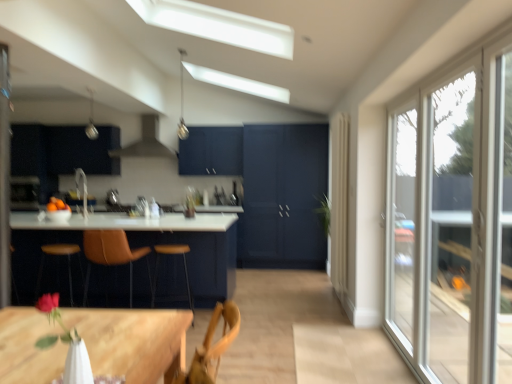
Describe the element at coordinates (91, 118) in the screenshot. I see `silver metallic light fixture at upper center, which ranks as the 1th light fixture in left-to-right order` at that location.

Identify the location of silver metallic light fixture at upper center, which ranks as the 1th light fixture in left-to-right order. (91, 118).

You are a GUI agent. You are given a task and a screenshot of the screen. Output one action in this format:
    pyautogui.click(x=<x>, y=<y>)
    Task: Click on the brown leather bar stool at left, the second bar stool in the right-to-left sequence
    This screenshot has height=384, width=512.
    Given the screenshot: What is the action you would take?
    pyautogui.click(x=60, y=255)

Describe the element at coordinates (172, 254) in the screenshot. I see `brown leather bar stool at center, marked as the second bar stool in a left-to-right arrangement` at that location.

Find the location of `matte white exhaust hood at upper center`. matte white exhaust hood at upper center is located at coordinates (146, 142).

How much distance is there between wooden table at lower left, the 2th table when ordered from front to back, and brown leather bar stool at left, the second bar stool in the right-to-left sequence?

wooden table at lower left, the 2th table when ordered from front to back, is 61.97 centimeters from brown leather bar stool at left, the second bar stool in the right-to-left sequence.

Considering the points (227, 263) and (70, 275), which point is behind, point (227, 263) or point (70, 275)?

Point (70, 275)

Can you confirm if wooden table at lower left, the second table from the right, is wider than brown leather bar stool at left, the second bar stool in the right-to-left sequence?

Correct, the width of wooden table at lower left, the second table from the right, exceeds that of brown leather bar stool at left, the second bar stool in the right-to-left sequence.

Is wooden table at lower left, the second table from the right, inside the boundaries of brown leather bar stool at left, arranged as the 1th bar stool when viewed from the left, or outside?

wooden table at lower left, the second table from the right, lies outside brown leather bar stool at left, arranged as the 1th bar stool when viewed from the left.

From a real-world perspective, is orange matte bowl at left over brown leather bar stool at center, marked as the second bar stool in a left-to-right arrangement?

Yes, from a real-world perspective, orange matte bowl at left is above brown leather bar stool at center, marked as the second bar stool in a left-to-right arrangement.

Between orange matte bowl at left and brown leather bar stool at center, which is the 1th bar stool in right-to-left order, which one has smaller width?

With smaller width is orange matte bowl at left.

Is orange matte bowl at left bigger or smaller than brown leather bar stool at center, which is the 1th bar stool in right-to-left order?

In the image, orange matte bowl at left appears to be smaller than brown leather bar stool at center, which is the 1th bar stool in right-to-left order.

From a real-world perspective, does clear glass window at right sit lower than wooden table at lower left, the 2th table when ordered from front to back?

No, from a real-world perspective, clear glass window at right is not below wooden table at lower left, the 2th table when ordered from front to back.

Is clear glass window at right not near wooden table at lower left, the 2th table when ordered from front to back?

Yes.

Is clear glass window at right not within wooden table at lower left, the second table from the right?

Yes, clear glass window at right is not within wooden table at lower left, the second table from the right.

Considering the relative positions of silver metallic light fixture at upper center, the 2th light fixture from the right, and matte white exhaust hood at upper center in the image provided, is silver metallic light fixture at upper center, the 2th light fixture from the right, to the left of matte white exhaust hood at upper center from the viewer's perspective?

Indeed, silver metallic light fixture at upper center, the 2th light fixture from the right, is positioned on the left side of matte white exhaust hood at upper center.

How different are the orientations of silver metallic light fixture at upper center, the 2th light fixture from the right, and matte white exhaust hood at upper center in degrees?

The facing directions of silver metallic light fixture at upper center, the 2th light fixture from the right, and matte white exhaust hood at upper center are 91.4 degrees apart.

Can you confirm if silver metallic light fixture at upper center, which ranks as the 1th light fixture in left-to-right order, is bigger than matte white exhaust hood at upper center?

No.

In the scene shown: From the image's perspective, which one is positioned lower, silver metallic light fixture at upper center, the 2th light fixture from the right, or matte white exhaust hood at upper center?

matte white exhaust hood at upper center.

Can you confirm if matte black cabinet at upper left is positioned to the right of matte white exhaust hood at upper center?

No.

Is matte black cabinet at upper left outside of matte white exhaust hood at upper center?

Absolutely, matte black cabinet at upper left is external to matte white exhaust hood at upper center.

From a real-world perspective, is matte black cabinet at upper left positioned under matte white exhaust hood at upper center based on gravity?

Yes, from a real-world perspective, matte black cabinet at upper left is below matte white exhaust hood at upper center.

From the picture: Is matte black cabinet at upper left directly adjacent to matte white exhaust hood at upper center?

No, matte black cabinet at upper left is not making contact with matte white exhaust hood at upper center.

From a real-world perspective, who is located lower, brown leather chair at center or wooden table at lower left, the 2th table when ordered from front to back?

wooden table at lower left, the 2th table when ordered from front to back, from a real-world perspective.

From the image's perspective, which one is positioned higher, brown leather chair at center or wooden table at lower left, which ranks as the 1th table in back-to-front order?

brown leather chair at center, from the image's perspective.

Which object is closer to the camera, brown leather chair at center or wooden table at lower left, the 1th table when ordered from left to right?

brown leather chair at center is more forward.

Looking at this image, is brown leather chair at center inside or outside of wooden table at lower left, the 1th table when ordered from left to right?

brown leather chair at center cannot be found inside wooden table at lower left, the 1th table when ordered from left to right.

From a real-world perspective, is brown leather chair at center above or below orange matte bowl at left?

brown leather chair at center is situated lower than orange matte bowl at left in the real world.

Considering the sizes of brown leather chair at center and orange matte bowl at left in the image, is brown leather chair at center taller or shorter than orange matte bowl at left?

Considering their sizes, brown leather chair at center has more height than orange matte bowl at left.

Is brown leather chair at center positioned before orange matte bowl at left?

That is True.

How much distance is there between brown leather chair at center and orange matte bowl at left?

33.47 inches.

Where is `the 1st table counting from the right side of the brown leather bar stool at left, the second bar stool in the right-to-left sequence`? This screenshot has height=384, width=512. the 1st table counting from the right side of the brown leather bar stool at left, the second bar stool in the right-to-left sequence is located at coordinates (141, 245).

From a real-world perspective, starting from the orange matte bowl at left, which bar stool is the 2nd one below it? Please provide its 2D coordinates.

[(172, 254)]

When comparing their distances from wooden table at lower left, the 2th table positioned from the left, does orange matte bowl at left or brown leather bar stool at left, arranged as the 1th bar stool when viewed from the left, seem closer?

brown leather bar stool at left, arranged as the 1th bar stool when viewed from the left.

Which object lies nearer to the anchor point matte black cabinet at upper left, matte dark blue cabinet at center or silver metallic light fixture at upper center, which ranks as the 1th light fixture in left-to-right order?

silver metallic light fixture at upper center, which ranks as the 1th light fixture in left-to-right order, lies closer to matte black cabinet at upper left than the other object.

When comparing their distances from silver metallic light fixture at upper center, the 2th light fixture from the right, does orange matte bowl at left or clear glass window at right seem further?

Based on the image, clear glass window at right appears to be further to silver metallic light fixture at upper center, the 2th light fixture from the right.

Based on their spatial positions, is clear glass window at right or metallic pendant light at upper center, arranged as the first light fixture when viewed from the right, further from matte dark blue cabinet at center?

clear glass window at right is positioned further to the anchor matte dark blue cabinet at center.

When comparing their distances from matte dark blue cabinet at center, does metallic pendant light at upper center, arranged as the first light fixture when viewed from the right, or silver metallic light fixture at upper center, which ranks as the 1th light fixture in left-to-right order, seem further?

Among the two, silver metallic light fixture at upper center, which ranks as the 1th light fixture in left-to-right order, is located further to matte dark blue cabinet at center.

Considering their positions, is orange matte bowl at left positioned further to matte dark blue cabinet at center than clear glass window at right?

clear glass window at right.

Looking at the image, which one is located closer to clear glass window at right, orange matte bowl at left or metallic pendant light at upper center, the second light fixture positioned from the left?

orange matte bowl at left is positioned closer to the anchor clear glass window at right.

Considering their positions, is matte black cabinet at upper left positioned closer to wooden table at lower left, the 2th table positioned from the left, than silver metallic light fixture at upper center, which ranks as the 1th light fixture in left-to-right order?

matte black cabinet at upper left is closer to wooden table at lower left, the 2th table positioned from the left.

You are a GUI agent. You are given a task and a screenshot of the screen. Output one action in this format:
    pyautogui.click(x=<x>, y=<y>)
    Task: Click on the door located between clear glass window at right and matte black cabinet at upper left in the depth direction
    Image resolution: width=512 pixels, height=384 pixels.
    Given the screenshot: What is the action you would take?
    pyautogui.click(x=283, y=196)

The image size is (512, 384). What are the coordinates of `bar stool between orange matte bowl at left and brown leather bar stool at center, marked as the second bar stool in a left-to-right arrangement` in the screenshot? It's located at (60, 255).

Where is `chair located between orange matte bowl at left and clear glass window at right in the left-right direction`? This screenshot has height=384, width=512. chair located between orange matte bowl at left and clear glass window at right in the left-right direction is located at coordinates (112, 254).

Where is `light fixture between metallic pendant light at upper center, the second light fixture positioned from the left, and wooden table at lower left, which ranks as the 1th table in back-to-front order, in the vertical direction`? light fixture between metallic pendant light at upper center, the second light fixture positioned from the left, and wooden table at lower left, which ranks as the 1th table in back-to-front order, in the vertical direction is located at coordinates (91, 118).